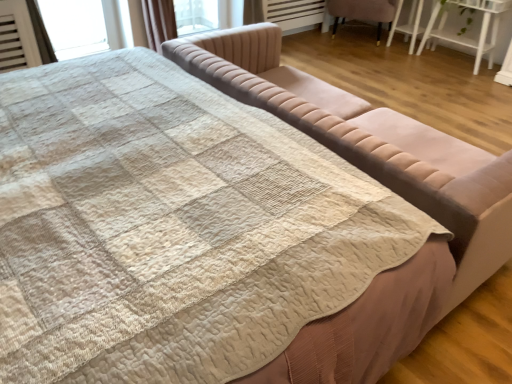
Question: Considering the positions of velvet beige studio couch at center and velvet pink chair at upper right in the image, is velvet beige studio couch at center taller or shorter than velvet pink chair at upper right?

Choices:
 (A) tall
 (B) short

Answer: (A)

Question: Considering their positions, is velvet beige studio couch at center located in front of or behind velvet pink chair at upper right?

Choices:
 (A) front
 (B) behind

Answer: (A)

Question: Considering the real-world distances, which object is closest to the velvet pink chair at upper right?

Choices:
 (A) velvet beige studio couch at center
 (B) white glossy table at upper right

Answer: (B)

Question: Based on their relative distances, which object is nearer to the velvet beige studio couch at center?

Choices:
 (A) white glossy table at upper right
 (B) velvet pink chair at upper right

Answer: (A)